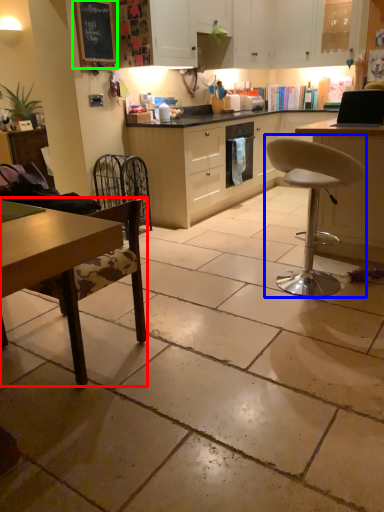
Question: Which object is positioned farthest from chair (highlighted by a red box)? Select from chair (highlighted by a blue box) and bulletin board (highlighted by a green box).

Choices:
 (A) chair
 (B) bulletin board

Answer: (B)